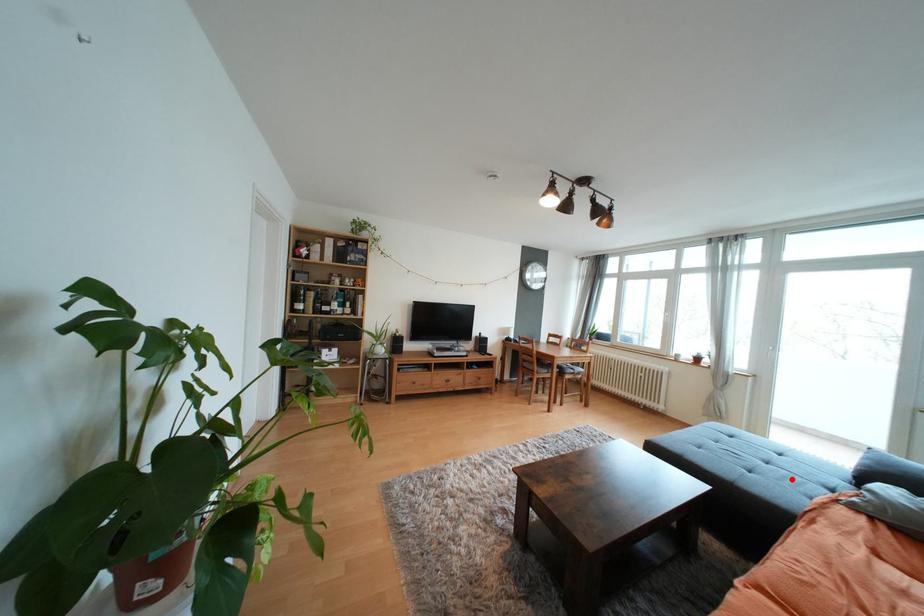
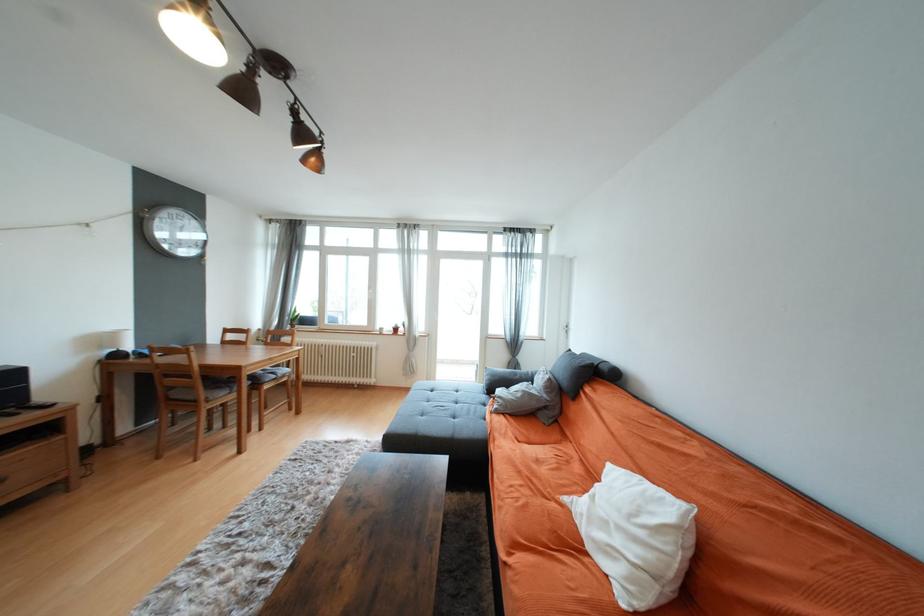
Find the pixel in the second image that matches the highlighted location in the first image.

(475, 411)